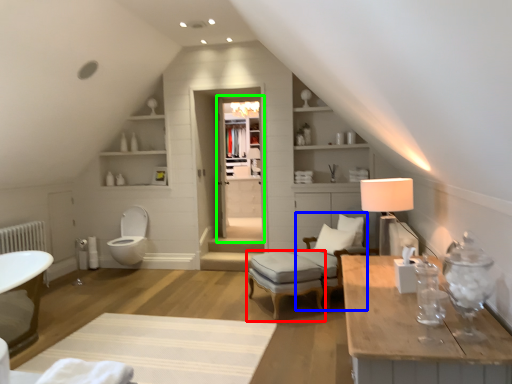
Question: Which object is the closest to the stool (highlighted by a red box)? Choose among these: swivel chair (highlighted by a blue box) or glass door (highlighted by a green box).

Choices:
 (A) swivel chair
 (B) glass door

Answer: (A)